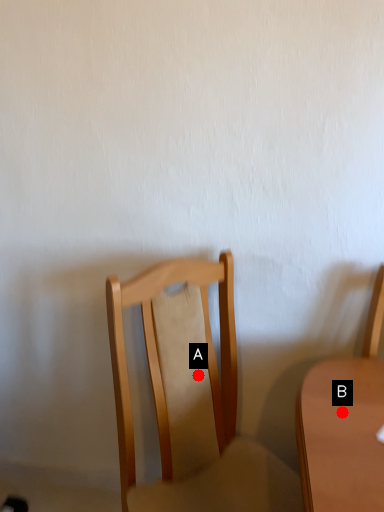
Question: Two points are circled on the image, labeled by A and B beside each circle. Which point appears closest to the camera in this image?

Choices:
 (A) A is closer
 (B) B is closer

Answer: (B)